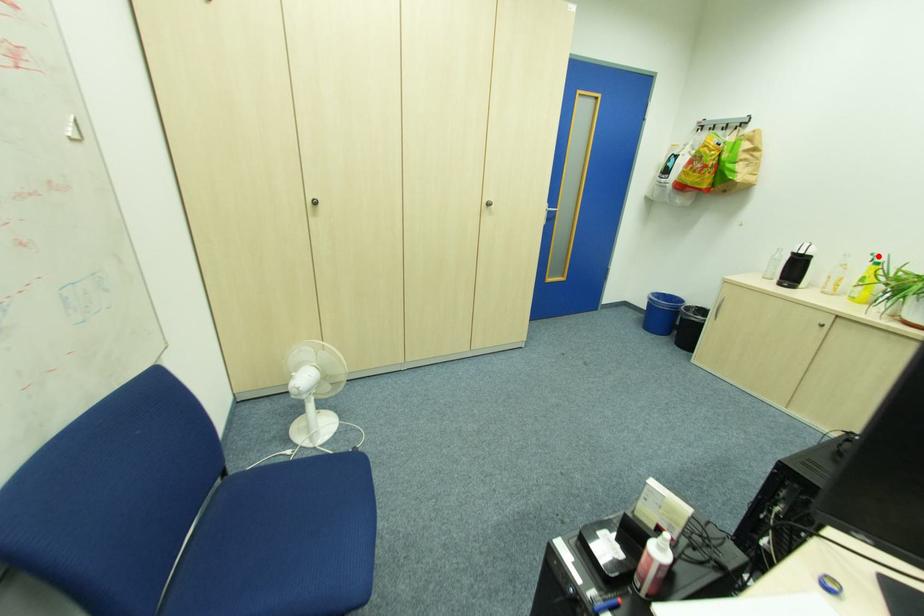
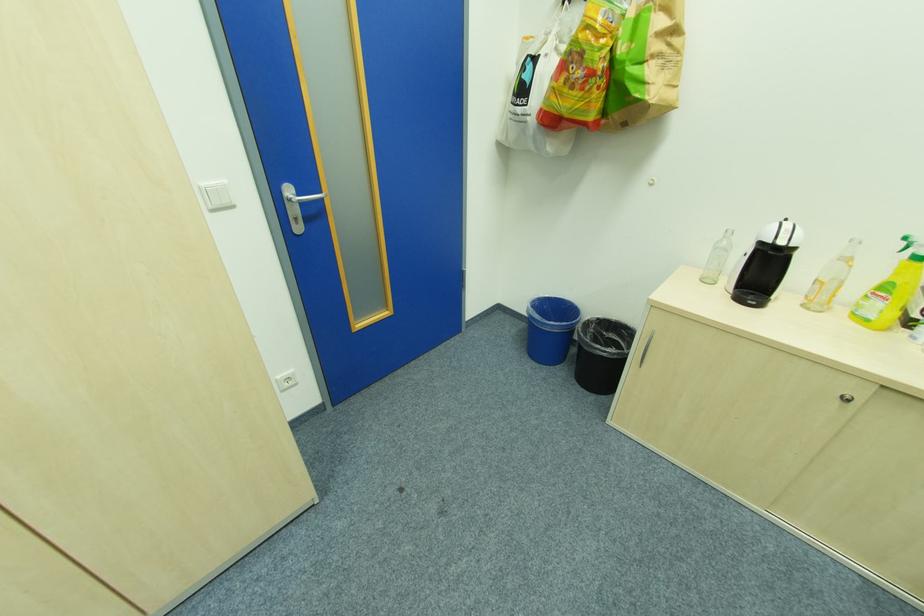
The point at the highlighted location is marked in the first image. Where is the corresponding point in the second image?

(909, 240)